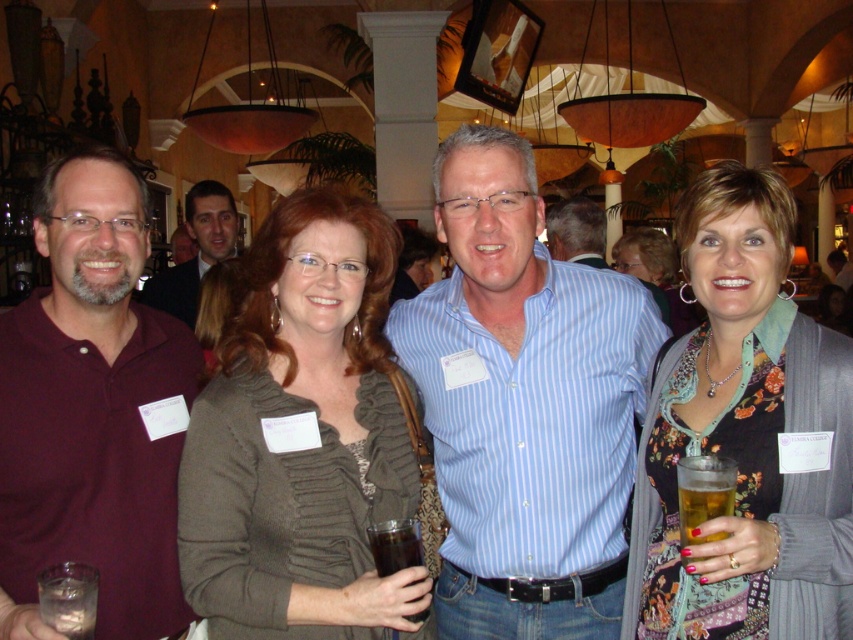
You are standing at the entrance of the venue and see two points marked in the image. The first point is at coordinates point [712,481] and the second is at point [654,257]. Which point is closer to you?

Point [712,481] is in front of point [654,257], so the first point is closer to you.

You are standing in the center of the room and want to pour a drink into the glass located at the golden amber liquid at lower right. Which direction should you move to reach it?

The golden amber liquid at lower right is located at point 0.775 on the x axis and 0.826 on the y axis, so you should move towards the lower right direction to reach it.

You are at a social event and need to grab a drink quickly. The golden amber liquid at lower right and the floral print dress at center are both in your line of sight. Which one is easier to reach without moving your current position?

The golden amber liquid at lower right is closer to the viewer than the floral print dress at center, so it is easier to reach without moving.